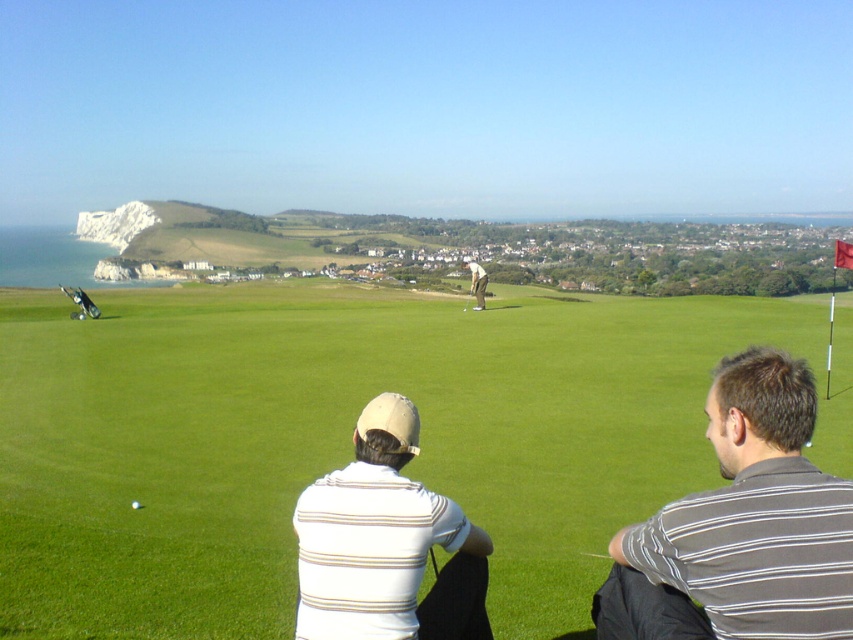
You are a golfer who wants to hit the white matte golf ball at center with the metallic silver golf club at center. Considering their sizes, which object should you use to strike the ball effectively?

The metallic silver golf club at center has a larger size compared to the white matte golf ball at center. You should use the metallic silver golf club at center to strike the ball effectively because its larger size provides better control and surface area for contact.

You are a golfer standing at the tee. You want to hit the ball to the green grass at center. Which direction should you aim? Please provide coordinates in the format of x,y where x and y are between 0 and 1, with 0,0 being the bottom left corner and 1,1 being the top right corner.

The green grass at center is located at coordinates point [346,440]. You should aim towards that coordinate.